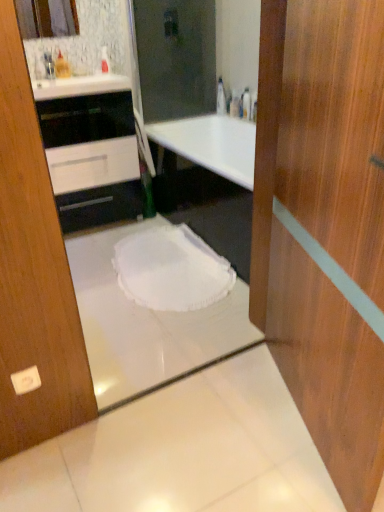
Question: From a real-world perspective, relative to transparent plastic bottle at upper center, is white fabric bath at center vertically above or below?

Choices:
 (A) below
 (B) above

Answer: (A)

Question: Considering their positions, is white fabric bath at center located in front of or behind transparent plastic bottle at upper center?

Choices:
 (A) behind
 (B) front

Answer: (B)

Question: Based on their relative distances, which object is nearer to the black glossy cabinet at upper left?

Choices:
 (A) white fabric bath at center
 (B) white fabric toilet at center
 (C) white glossy counter top at upper center
 (D) matte glass mirror at upper left
 (E) transparent plastic bottle at upper center

Answer: (C)

Question: Based on their relative distances, which object is nearer to the white fabric toilet at center?

Choices:
 (A) transparent plastic bottle at upper center
 (B) matte glass mirror at upper left
 (C) white fabric bath at center
 (D) white glossy counter top at upper center
 (E) black glossy cabinet at upper left

Answer: (C)